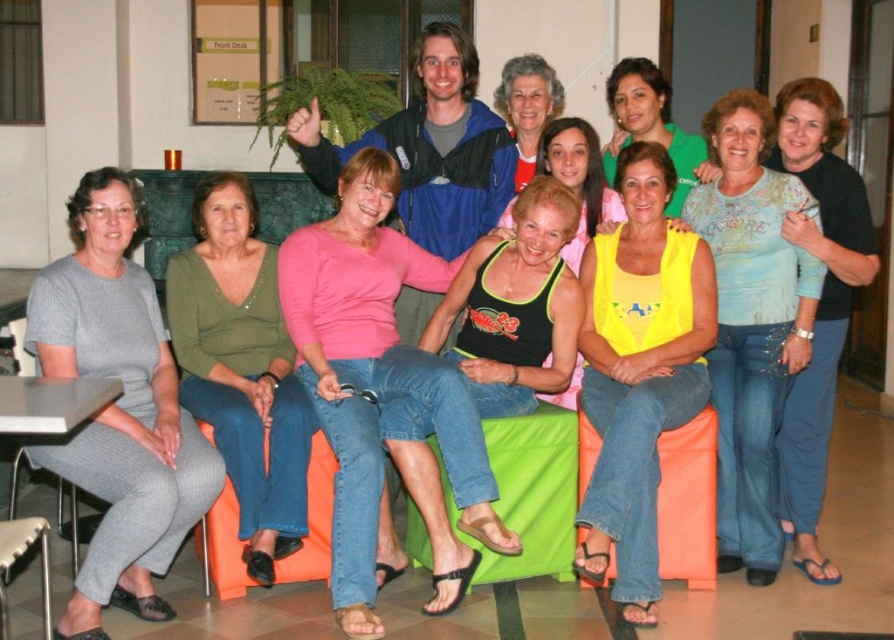
Does yellow matte tank top at center lie behind black tank top at center?

That is False.

Does point (635, 192) lie in front of point (597, 189)?

Yes, point (635, 192) is in front of point (597, 189).

Find the location of a particular element. Image resolution: width=894 pixels, height=640 pixels. yellow matte tank top at center is located at coordinates (639, 371).

Find the location of a particular element. This screenshot has width=894, height=640. light blue cotton shirt at center is located at coordinates (751, 321).

Is light blue cotton shirt at center behind black tank top at center?

No, it is not.

Locate an element on the screen. The image size is (894, 640). light blue cotton shirt at center is located at coordinates (751, 321).

At what (x,y) coordinates should I click in order to perform the action: click on light blue cotton shirt at center. Please return your answer as a coordinate pair (x, y). The height and width of the screenshot is (640, 894). Looking at the image, I should click on (751, 321).

Is gray knit dress at left in front of matte black tank top at center?

That is True.

Looking at this image, who is taller, gray knit dress at left or matte black tank top at center?

gray knit dress at left

Which is in front, point (128, 508) or point (547, 90)?

Positioned in front is point (128, 508).

Locate an element on the screen. This screenshot has height=640, width=894. gray knit dress at left is located at coordinates (117, 406).